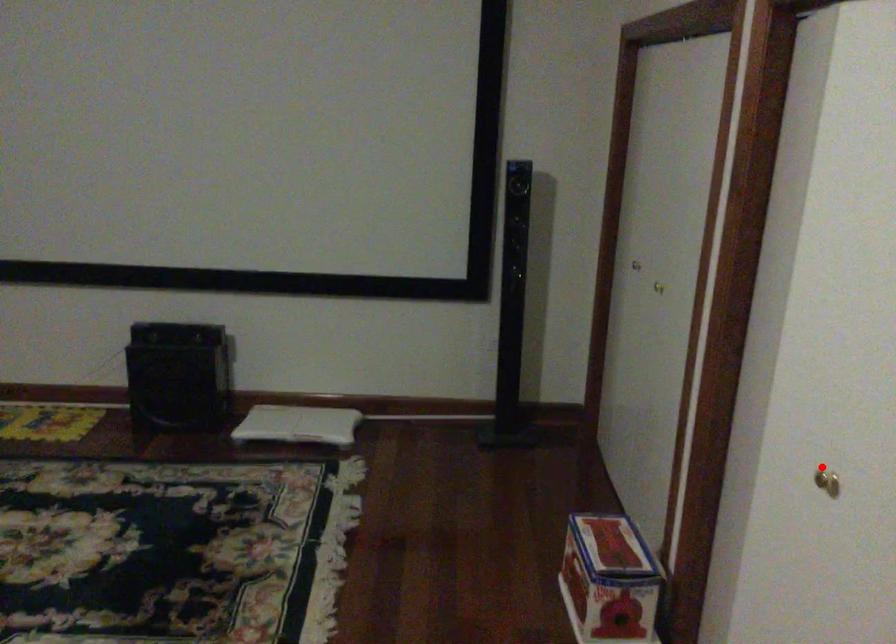
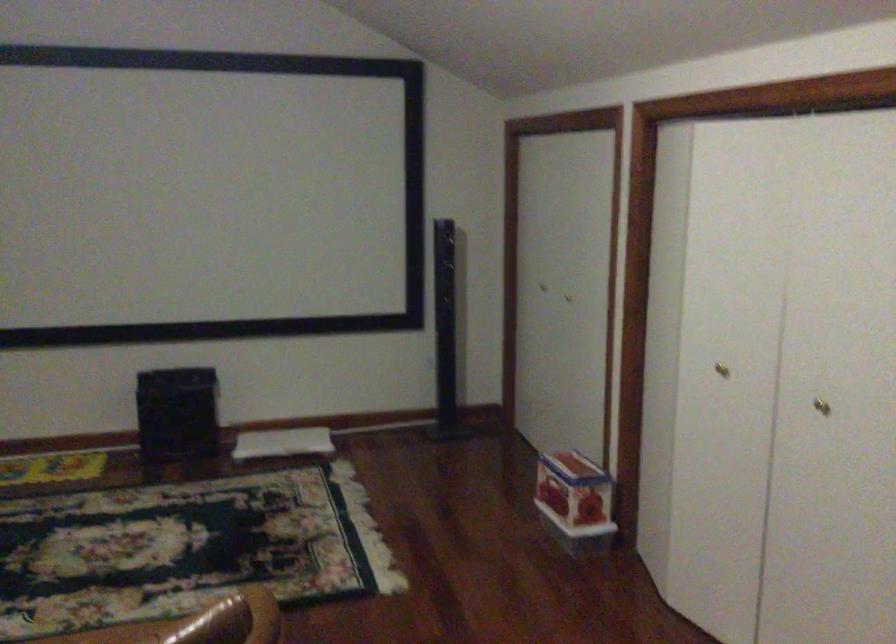
Question: I am providing you with two images of the same scene from different viewpoints. Given a red point in image1, look at the same physical point in image2. Is it:

Choices:
 (A) Closer to the viewpoint
 (B) Farther from the viewpoint

Answer: (B)